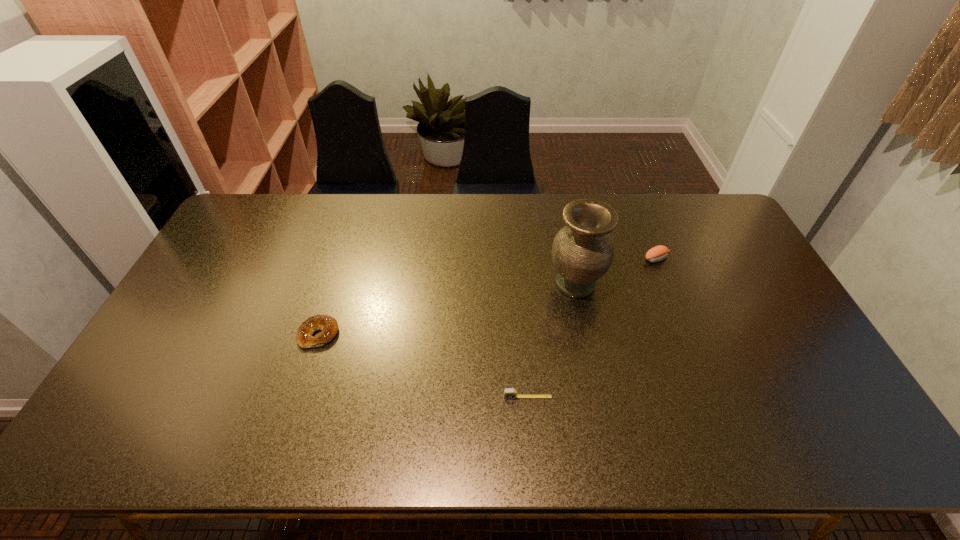
Find the location of a particular element. free point located on the back of the leftmost object is located at coordinates (345, 252).

At what (x,y) coordinates should I click in order to perform the action: click on vacant region located 0.140m at the front of the nearest object with the tape extended. Please return your answer as a coordinate pair (x, y). Image resolution: width=960 pixels, height=540 pixels. Looking at the image, I should click on pos(532,455).

Where is `free space at the far edge of the desktop`? The image size is (960, 540). free space at the far edge of the desktop is located at coordinates (679, 221).

Identify the location of vacant region at the near edge of the desktop. (185, 453).

Locate an element on the screen. The height and width of the screenshot is (540, 960). vacant area at the left edge of the desktop is located at coordinates click(144, 380).

At what (x,y) coordinates should I click in order to perform the action: click on vacant space at the far left corner. Please return your answer as a coordinate pair (x, y). The height and width of the screenshot is (540, 960). Looking at the image, I should click on (245, 231).

At what (x,y) coordinates should I click in order to perform the action: click on vacant area at the near left corner. Please return your answer as a coordinate pair (x, y). This screenshot has width=960, height=540. Looking at the image, I should click on (x=135, y=433).

What are the coordinates of `free spot between the vase and the nearest object` in the screenshot? It's located at (552, 340).

Image resolution: width=960 pixels, height=540 pixels. What are the coordinates of `free space between the second tallest object and the vase` in the screenshot? It's located at (616, 271).

Where is `unoccupied area between the vase and the bagel`? The width and height of the screenshot is (960, 540). unoccupied area between the vase and the bagel is located at coordinates (447, 309).